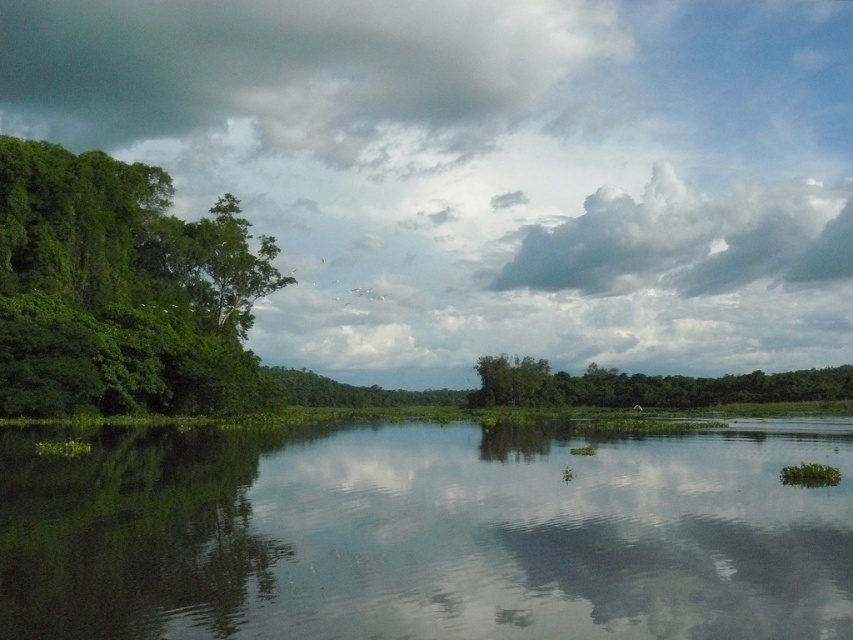
You are standing at the edge of the water and want to look at both the green reflective water at center and the white fluffy cloud at upper center. Which object is nearer to you?

The green reflective water at center is closer to the viewer than the white fluffy cloud at upper center.

You are standing at the lakeside and want to take a photo of the green reflective water at center and the white fluffy cloud at upper center. Which object will appear smaller in your photo?

The green reflective water at center will appear smaller in the photo because it has a smaller size compared to the white fluffy cloud at upper center.

You are standing at the origin point of the coordinate system in the scene. You want to walk to the green reflective water at center. In which direction should you move relative to your current position?

The green reflective water at center is located at coordinate point 0.836 on the x axis and 0.501 on the y axis. Since you are at the origin point, you should move in the positive x direction to reach it.